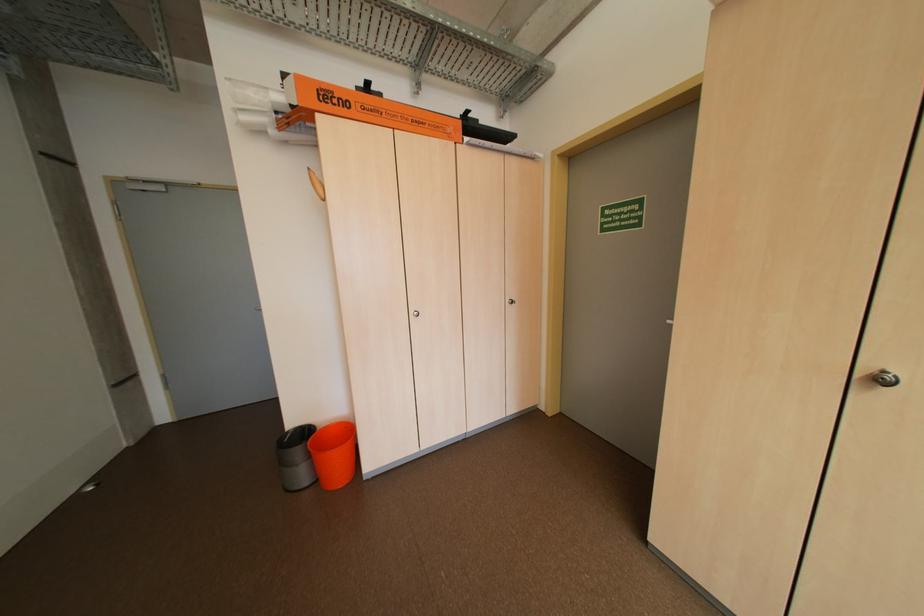
Locate an element on the screen. The image size is (924, 616). silver door knob is located at coordinates (884, 378).